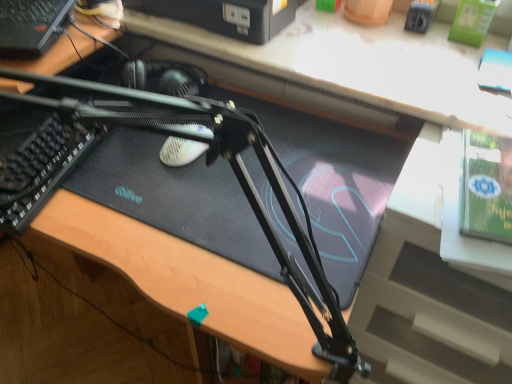
Question: Should I look upward or downward to see black plastic computer at upper left, arranged as the second computer when viewed from the right?

Choices:
 (A) down
 (B) up

Answer: (B)

Question: Can you confirm if black plastic printer at upper center, acting as the 2th computer starting from the left, is shorter than black matte computer desk at center?

Choices:
 (A) no
 (B) yes

Answer: (A)

Question: Is black plastic printer at upper center, the first computer positioned from the right, oriented away from black matte computer desk at center?

Choices:
 (A) no
 (B) yes

Answer: (A)

Question: Considering the relative positions of black plastic printer at upper center, the first computer positioned from the right, and black matte computer desk at center in the image provided, is black plastic printer at upper center, the first computer positioned from the right, to the left of black matte computer desk at center from the viewer's perspective?

Choices:
 (A) yes
 (B) no

Answer: (A)

Question: From the image's perspective, is black plastic printer at upper center, acting as the 2th computer starting from the left, beneath black matte computer desk at center?

Choices:
 (A) yes
 (B) no

Answer: (B)

Question: Is black matte computer desk at center surrounded by black plastic printer at upper center, acting as the 2th computer starting from the left?

Choices:
 (A) yes
 (B) no

Answer: (B)

Question: Considering the relative positions of black plastic printer at upper center, the first computer positioned from the right, and black matte computer desk at center in the image provided, is black plastic printer at upper center, the first computer positioned from the right, in front of black matte computer desk at center?

Choices:
 (A) yes
 (B) no

Answer: (B)

Question: Is black matte computer desk at center completely or partially outside of black plastic computer at upper left, the 1th computer in the left-to-right sequence?

Choices:
 (A) yes
 (B) no

Answer: (A)

Question: Is black matte computer desk at center surrounding black plastic computer at upper left, the 1th computer in the left-to-right sequence?

Choices:
 (A) yes
 (B) no

Answer: (B)

Question: Are black matte computer desk at center and black plastic computer at upper left, the 1th computer in the left-to-right sequence, located far from each other?

Choices:
 (A) no
 (B) yes

Answer: (A)

Question: Is black matte computer desk at center shorter than black plastic computer at upper left, arranged as the second computer when viewed from the right?

Choices:
 (A) no
 (B) yes

Answer: (B)

Question: Considering the relative sizes of black matte computer desk at center and black plastic computer at upper left, arranged as the second computer when viewed from the right, in the image provided, is black matte computer desk at center taller than black plastic computer at upper left, arranged as the second computer when viewed from the right,?

Choices:
 (A) no
 (B) yes

Answer: (A)

Question: Considering the relative sizes of black matte computer desk at center and black plastic computer at upper left, arranged as the second computer when viewed from the right, in the image provided, is black matte computer desk at center thinner than black plastic computer at upper left, arranged as the second computer when viewed from the right,?

Choices:
 (A) no
 (B) yes

Answer: (A)

Question: Is black matte computer desk at center at the left side of green matte paperback book at upper right?

Choices:
 (A) yes
 (B) no

Answer: (A)